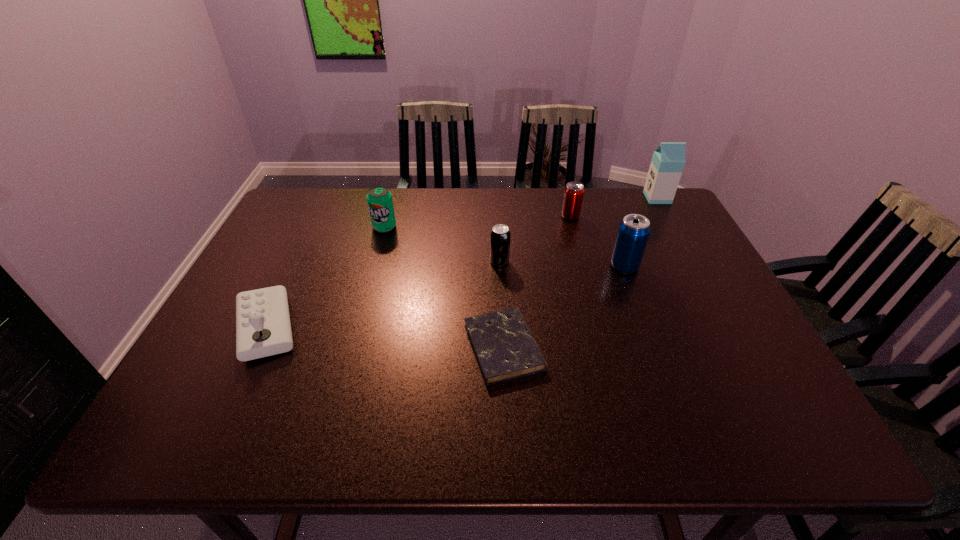
Find the location of a particular element. This screenshot has width=960, height=540. soda can that stands as the closest to the leftmost soda can is located at coordinates (500, 235).

Select which soda can is the second closest to the second soda can from left to right. Please provide its 2D coordinates. Your answer should be formatted as a tuple, i.e. [(x, y)], where the tuple contains the x and y coordinates of a point satisfying the conditions above.

[(632, 236)]

This screenshot has height=540, width=960. What are the coordinates of `free space that satisfies the following two spatial constraints: 1. on the front-facing side of the diary; 2. on the left side of the sixth object from right to left` in the screenshot? It's located at (351, 347).

Where is `vacant space that satisfies the following two spatial constraints: 1. on the front-facing side of the second soda can from left to right; 2. on the right side of the leftmost soda can`? The height and width of the screenshot is (540, 960). vacant space that satisfies the following two spatial constraints: 1. on the front-facing side of the second soda can from left to right; 2. on the right side of the leftmost soda can is located at coordinates (375, 261).

Identify the location of vacant position in the image that satisfies the following two spatial constraints: 1. on the back side of the shortest object; 2. on the right side of the second soda can from left to right. This screenshot has height=540, width=960. (499, 261).

Locate an element on the screen. free space that satisfies the following two spatial constraints: 1. on the back side of the third object from right to left; 2. on the left side of the joystick is located at coordinates (320, 217).

Find the location of a particular element. free point that satisfies the following two spatial constraints: 1. on the front-facing side of the leftmost soda can; 2. on the right side of the rightmost soda can is located at coordinates (373, 266).

At what (x,y) coordinates should I click in order to perform the action: click on free point that satisfies the following two spatial constraints: 1. on the front-facing side of the leftmost soda can; 2. on the left side of the sixth shortest object. Please return your answer as a coordinate pair (x, y). The height and width of the screenshot is (540, 960). Looking at the image, I should click on (373, 266).